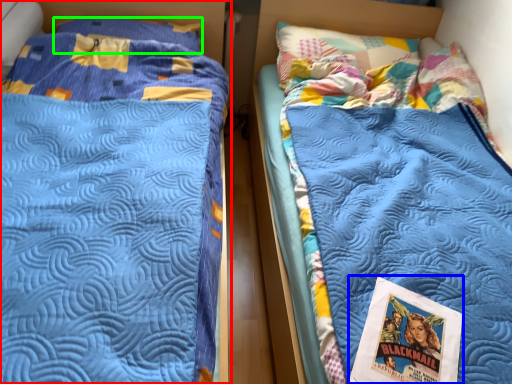
Question: Which is nearer to the bed (highlighted by a red box)? comic book (highlighted by a blue box) or pillow (highlighted by a green box).

Choices:
 (A) comic book
 (B) pillow

Answer: (B)